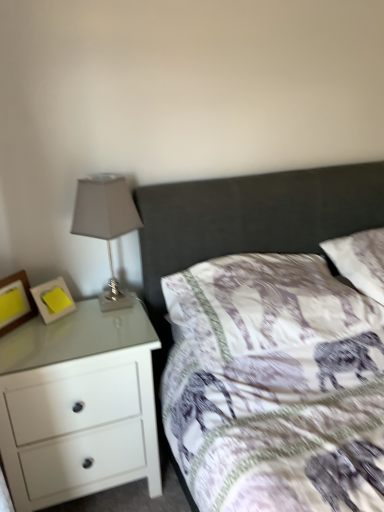
Where is `vacant space that's between yellow paper at left, marked as the 1th picture frame in a right-to-left arrangement, and matte gray glass table lamp at left`? The height and width of the screenshot is (512, 384). vacant space that's between yellow paper at left, marked as the 1th picture frame in a right-to-left arrangement, and matte gray glass table lamp at left is located at coordinates (73, 318).